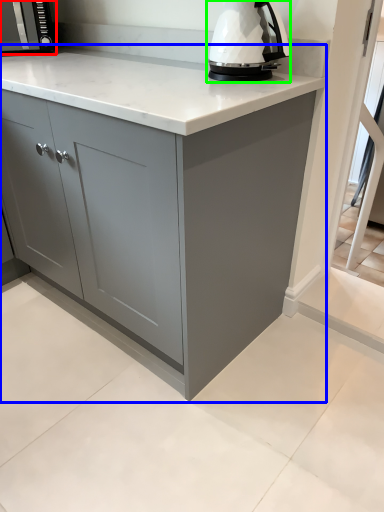
Question: Estimate the real-world distances between objects in this image. Which object is closer to kitchen appliance (highlighted by a red box), cabinetry (highlighted by a blue box) or home appliance (highlighted by a green box)?

Choices:
 (A) cabinetry
 (B) home appliance

Answer: (B)